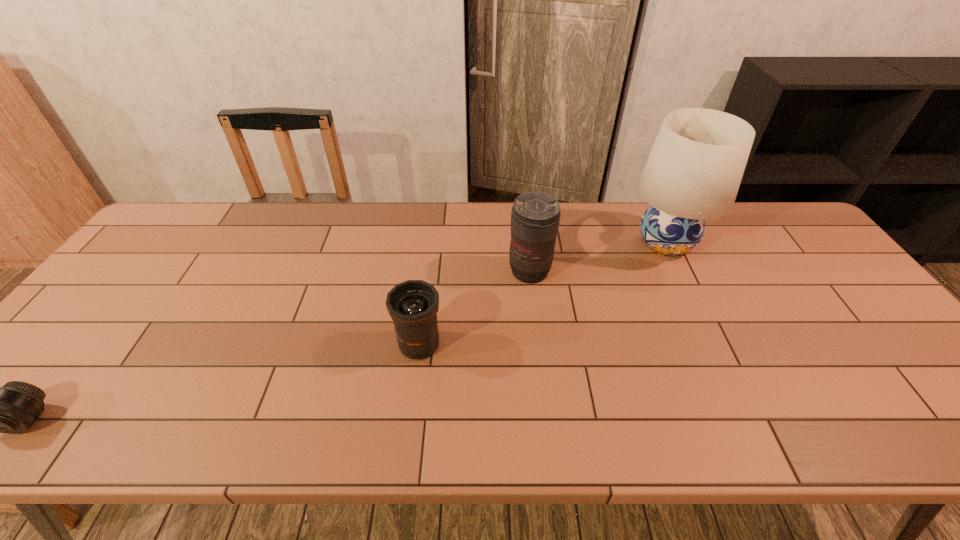
Locate an element on the screen. The height and width of the screenshot is (540, 960). the tallest object is located at coordinates (693, 172).

Where is `the rightmost object`? The image size is (960, 540). the rightmost object is located at coordinates (693, 172).

The height and width of the screenshot is (540, 960). I want to click on the tallest telephoto lens, so click(535, 216).

I want to click on the farthest telephoto lens, so click(x=535, y=216).

Locate an element on the screen. This screenshot has width=960, height=540. the third farthest object is located at coordinates (413, 305).

Image resolution: width=960 pixels, height=540 pixels. Identify the location of the second shortest telephoto lens. (413, 305).

I want to click on blank area located on the front-facing side of the lampshade, so click(x=685, y=284).

Identify the location of vacant space located on the side of the rightmost telephoto lens where the control switches are located. The height and width of the screenshot is (540, 960). (544, 397).

Locate an element on the screen. free spot located 0.090m on the front of the second shortest object is located at coordinates (413, 398).

You are a GUI agent. You are given a task and a screenshot of the screen. Output one action in this format:
    pyautogui.click(x=<x>, y=<y>)
    Task: Click on the object at the far edge
    
    Given the screenshot: What is the action you would take?
    pyautogui.click(x=693, y=172)